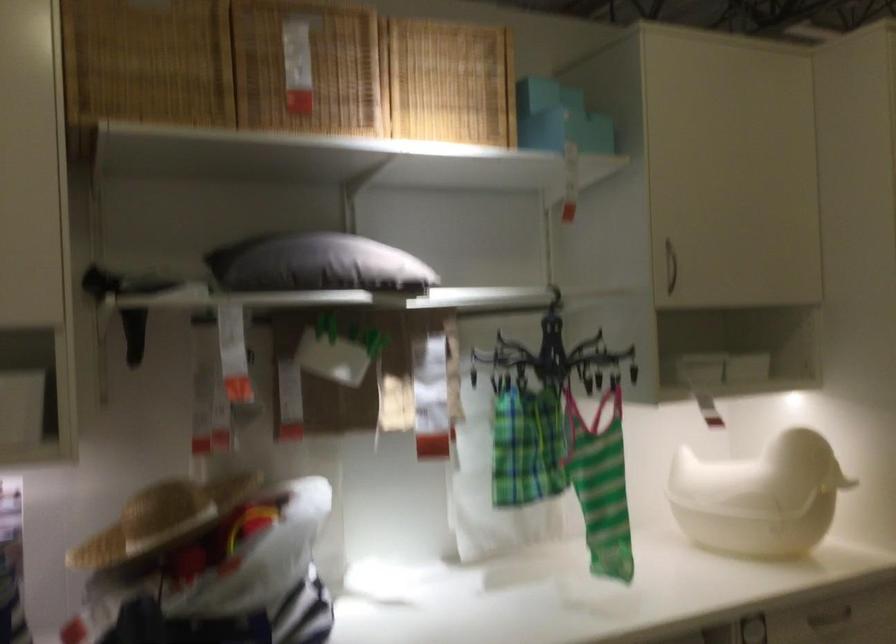
Locate an element on the screen. Image resolution: width=896 pixels, height=644 pixels. light blue box is located at coordinates (558, 118).